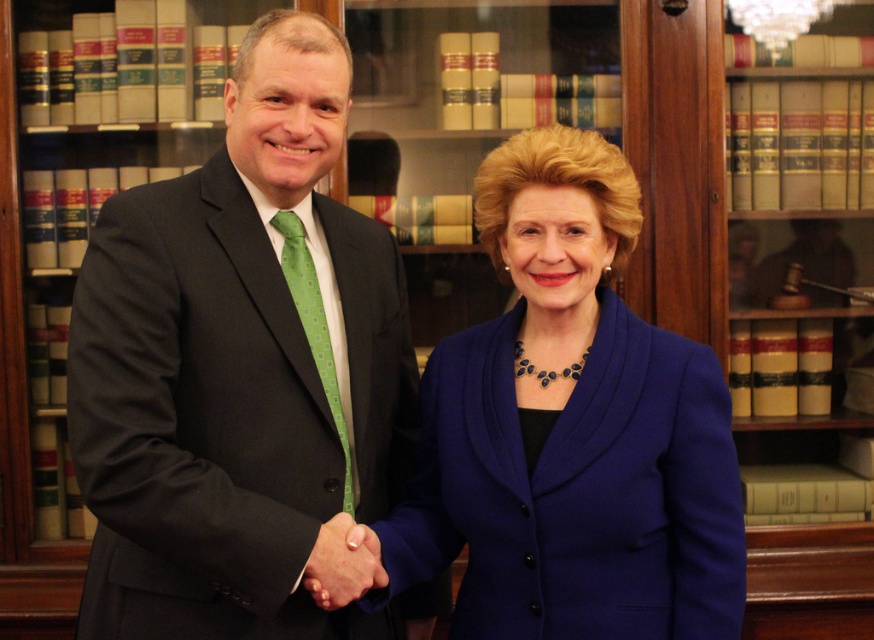
You are standing in front of the bookshelf and see the point at coordinates (x=571, y=429). What object is located at this point?

The point at coordinates (x=571, y=429) corresponds to the blue fabric jacket at center.

You are a photographer positioned to the side of the scene. You want to take a photo that includes both the black suit at left and the green dotted tie at center. Which object should you focus on first to ensure both are in sharp focus?

The black suit at left is closer to the viewer than the green dotted tie at center, so focusing on the black suit at left will ensure both are in sharp focus since it is the closer object.

You are a photographer aiming to capture a clear photo of both the blue fabric jacket at center and the smooth skin handshake at center. Can you fit both subjects into the frame if your camera has a minimum focus distance of 12 inches?

The blue fabric jacket at center and smooth skin handshake at center are 13.49 inches apart. Since the distance between them is greater than the camera minimum focus distance of 12 inches, the camera can focus on both subjects and fit them into the frame.